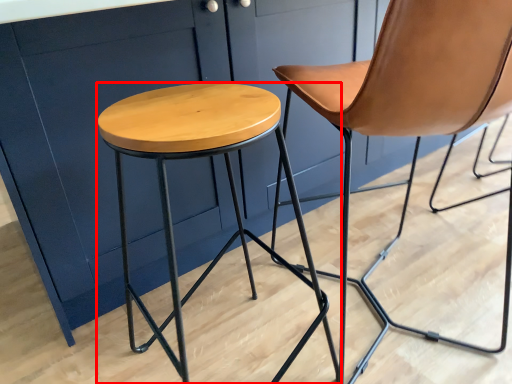
Question: From the image's perspective, where is stool (annotated by the red box) located in relation to chair in the image?

Choices:
 (A) above
 (B) below

Answer: (B)